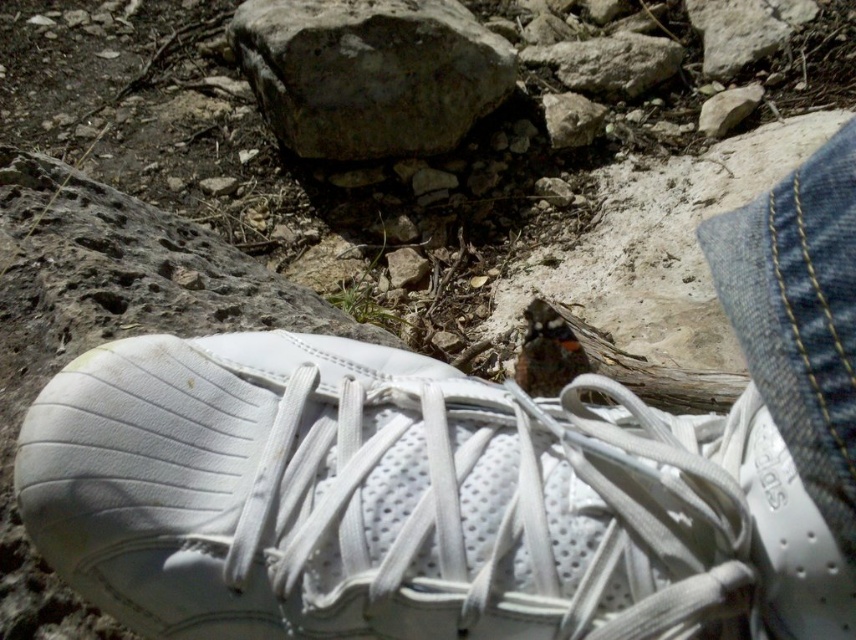
Question: Is gray rough rock at center smaller than gray rough rock at upper right?

Choices:
 (A) no
 (B) yes

Answer: (A)

Question: Which object appears closest to the camera in this image?

Choices:
 (A) gray rough rock at upper right
 (B) smooth gray rock at upper center
 (C) gray rough rock at center

Answer: (C)

Question: Which object appears farthest from the camera in this image?

Choices:
 (A) white leather shoe at center
 (B) gray rough rock at upper right
 (C) gray rough rock at center
 (D) smooth gray rock at center

Answer: (D)

Question: Does gray rough rock at center appear under smooth gray rock at center?

Choices:
 (A) yes
 (B) no

Answer: (B)

Question: Is the position of white leather shoe at center more distant than that of gray rough rock at upper right?

Choices:
 (A) no
 (B) yes

Answer: (A)

Question: Which of these objects is positioned farthest from the smooth gray rock at center?

Choices:
 (A) white leather shoe at center
 (B) gray rough rock at center
 (C) smooth gray rock at upper center

Answer: (A)